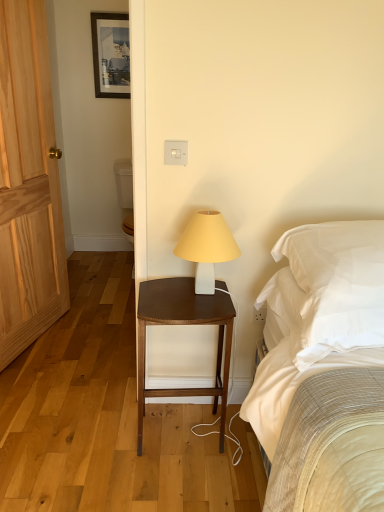
At what (x,y) coordinates should I click in order to perform the action: click on free point below brown wood nightstand at center (from a real-world perspective). Please return your answer as a coordinate pair (x, y). Image resolution: width=384 pixels, height=512 pixels. Looking at the image, I should click on (184, 430).